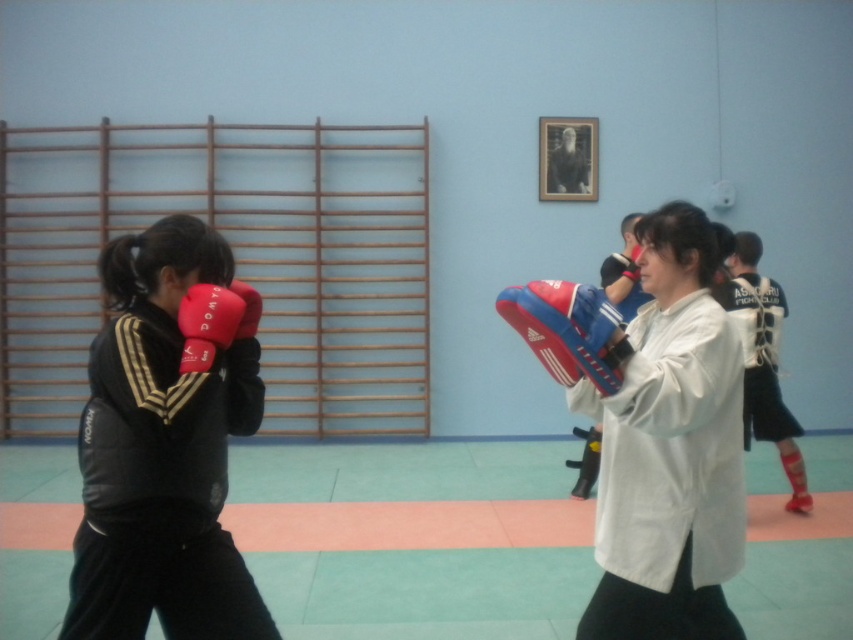
Question: Can you confirm if matte black jacket at left is smaller than red leather boxing glove at center?

Choices:
 (A) no
 (B) yes

Answer: (A)

Question: Which object is closer to the camera taking this photo?

Choices:
 (A) red leather boxing glove at left
 (B) matte black jacket at left
 (C) red leather boxing glove at center

Answer: (B)

Question: Is matte black jacket at left smaller than red leather boxing glove at center?

Choices:
 (A) no
 (B) yes

Answer: (A)

Question: Which point is farther from the camera taking this photo?

Choices:
 (A) pos(178,566)
 (B) pos(241,289)
 (C) pos(221,337)

Answer: (B)

Question: Can you confirm if matte black jacket at left is positioned below red leather boxing glove at center?

Choices:
 (A) no
 (B) yes

Answer: (B)

Question: Estimate the real-world distances between objects in this image. Which object is closer to the red leather boxing glove at left?

Choices:
 (A) matte black jacket at left
 (B) matte red boxing glove at left
 (C) red leather boxing glove at center

Answer: (B)